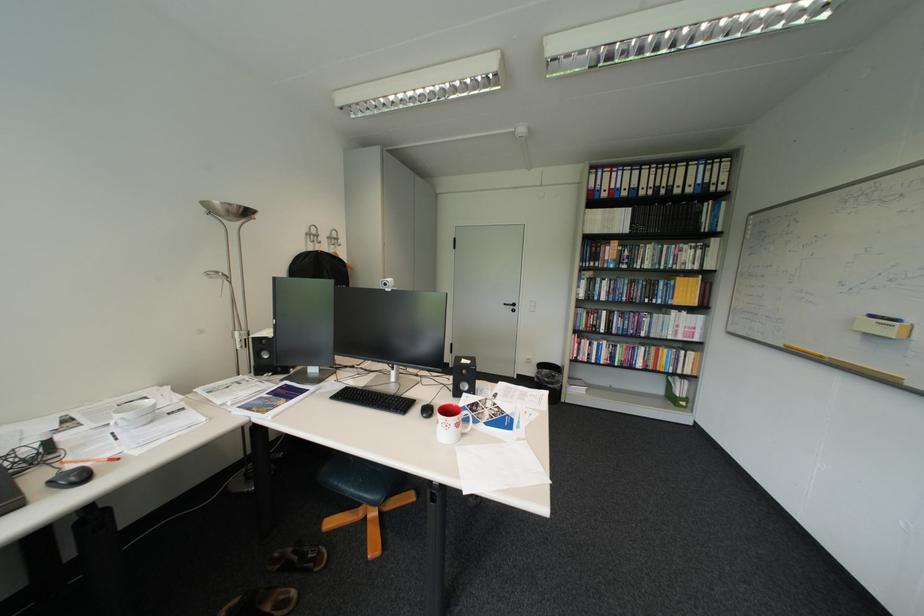
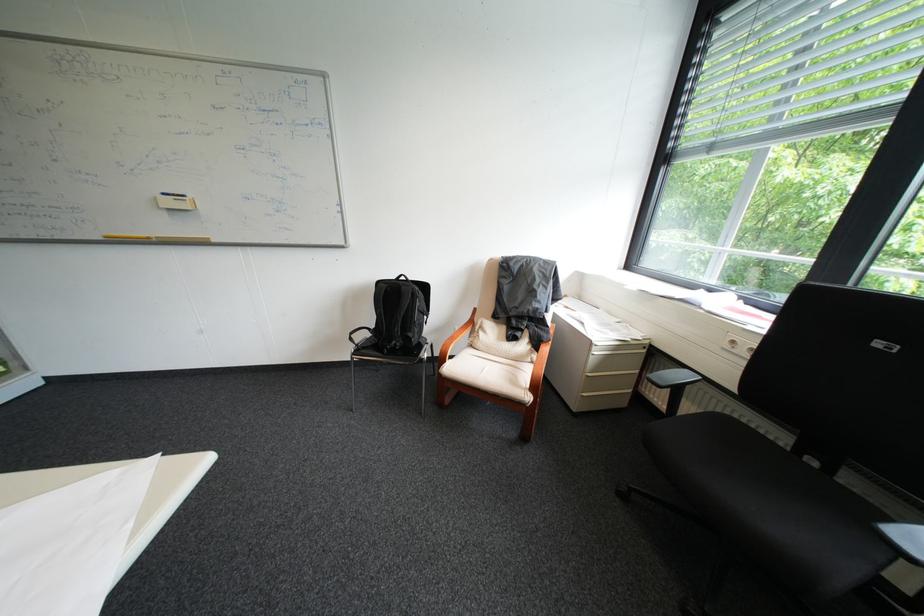
The point at (884,315) is marked in the first image. Where is the corresponding point in the second image?

(176, 195)